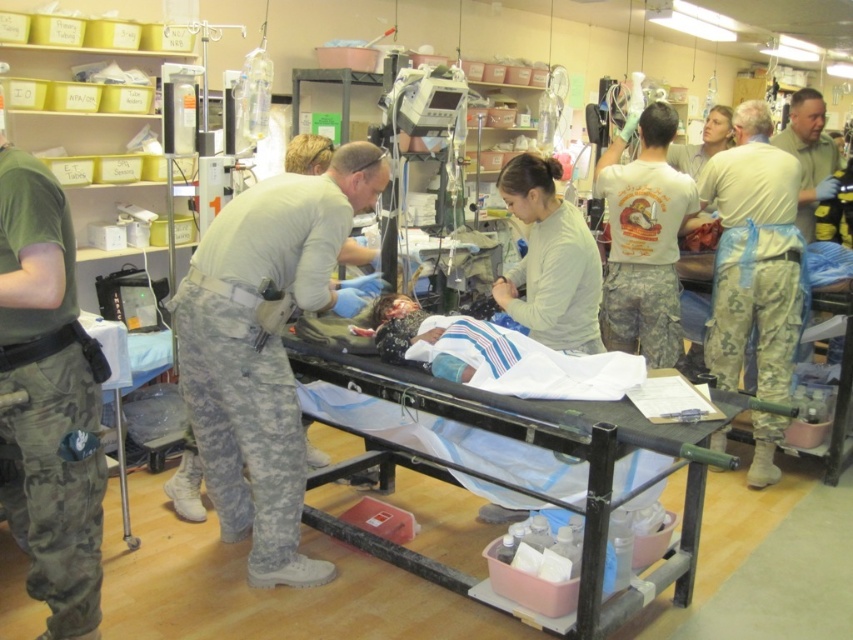
Question: Where is green camouflage pants at left located in relation to green uniform at upper right in the image?

Choices:
 (A) below
 (B) above

Answer: (A)

Question: Which point is closer to the camera?

Choices:
 (A) (779, 134)
 (B) (647, 116)
 (C) (254, 400)

Answer: (C)

Question: Is green camouflage pants at left bigger than black matte stretcher at center?

Choices:
 (A) yes
 (B) no

Answer: (B)

Question: Which object is farther from the camera taking this photo?

Choices:
 (A) black matte stretcher at center
 (B) green uniform at upper right
 (C) green camouflage pants at left

Answer: (B)

Question: Which point is farther from the camera taking this photo?

Choices:
 (A) (697, 532)
 (B) (805, 182)
 (C) (68, 236)
 (D) (334, 572)

Answer: (B)

Question: Does camouflage pants at center appear over light beige uniform at right?

Choices:
 (A) yes
 (B) no

Answer: (B)